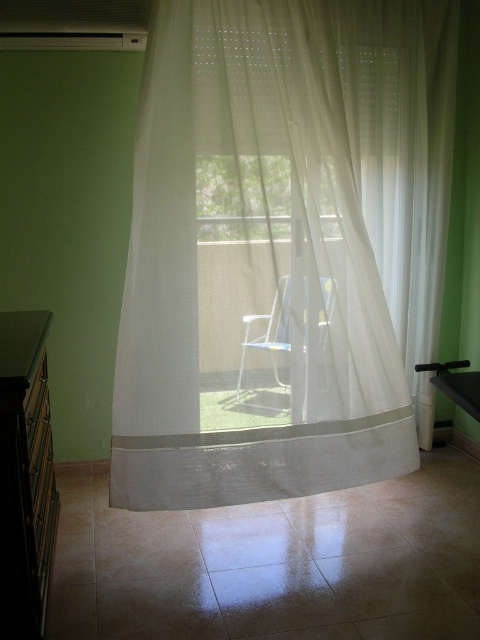
Question: Is matte black dresser at left wider than transparent fabric window at center?

Choices:
 (A) no
 (B) yes

Answer: (A)

Question: Which object is farther from the camera taking this photo?

Choices:
 (A) matte black dresser at left
 (B) transparent fabric window at center

Answer: (B)

Question: Which point is farther to the camera?

Choices:
 (A) (289, 387)
 (B) (386, 477)
 (C) (219, 224)

Answer: (B)

Question: From the image, what is the correct spatial relationship of matte black dresser at left in relation to transparent fabric window at center?

Choices:
 (A) left
 (B) right

Answer: (A)

Question: Estimate the real-world distances between objects in this image. Which object is farther from the matte black dresser at left?

Choices:
 (A) white sheer curtain at center
 (B) white mesh chair at center
 (C) transparent fabric window at center

Answer: (C)

Question: Does matte black dresser at left appear under white mesh chair at center?

Choices:
 (A) no
 (B) yes

Answer: (B)